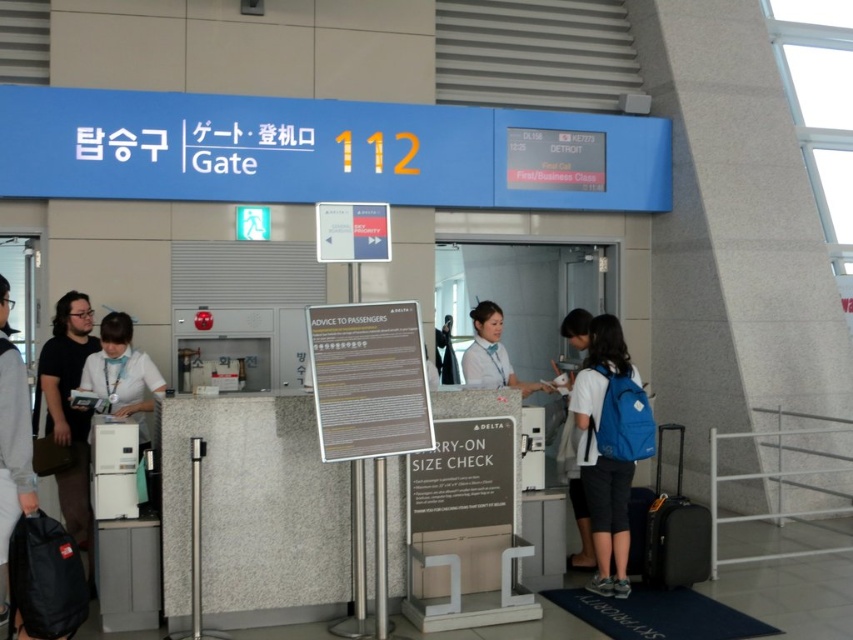
Question: Which point is farther from the camera taking this photo?

Choices:
 (A) (9, 380)
 (B) (36, 552)

Answer: (B)

Question: From the image, what is the correct spatial relationship of black hardshell suitcase at lower right in relation to blue fabric backpack at center-right?

Choices:
 (A) below
 (B) above

Answer: (A)

Question: Where is black fabric backpack at lower left located in relation to white uniform at center in the image?

Choices:
 (A) above
 (B) below

Answer: (B)

Question: Is blue fabric backpack at lower right wider than black hardshell suitcase at lower right?

Choices:
 (A) yes
 (B) no

Answer: (B)

Question: Which of the following is the closest to the observer?

Choices:
 (A) blue fabric backpack at center-right
 (B) blue fabric backpack at lower right
 (C) black fabric backpack at lower left

Answer: (C)

Question: Estimate the real-world distances between objects in this image. Which object is farther from the blue fabric backpack at lower right?

Choices:
 (A) white uniform at center
 (B) black fabric backpack at lower left

Answer: (B)